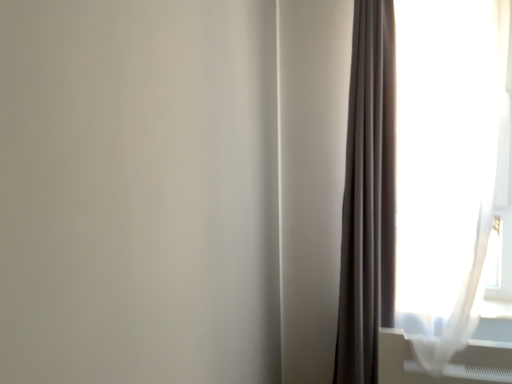
Question: From a real-world perspective, is white sheer curtain at right, the first curtain in the right-to-left sequence, positioned above or below matte gray curtain at right, arranged as the 1th curtain when viewed from the left?

Choices:
 (A) below
 (B) above

Answer: (B)

Question: Considering the relative positions of white sheer curtain at right, which is the second curtain from left to right, and matte gray curtain at right, the second curtain in the right-to-left sequence, in the image provided, is white sheer curtain at right, which is the second curtain from left to right, to the left or to the right of matte gray curtain at right, the second curtain in the right-to-left sequence,?

Choices:
 (A) right
 (B) left

Answer: (A)

Question: Is white sheer curtain at right, the first curtain in the right-to-left sequence, in front of or behind matte gray curtain at right, the second curtain in the right-to-left sequence, in the image?

Choices:
 (A) front
 (B) behind

Answer: (A)

Question: Would you say matte gray curtain at right, arranged as the 1th curtain when viewed from the left, is to the left or to the right of white sheer curtain at right, which is the second curtain from left to right, in the picture?

Choices:
 (A) left
 (B) right

Answer: (A)

Question: In terms of width, does matte gray curtain at right, the second curtain in the right-to-left sequence, look wider or thinner when compared to white sheer curtain at right, which is the second curtain from left to right?

Choices:
 (A) wide
 (B) thin

Answer: (B)

Question: From the image's perspective, relative to white sheer curtain at right, the first curtain in the right-to-left sequence, is matte gray curtain at right, the second curtain in the right-to-left sequence, above or below?

Choices:
 (A) above
 (B) below

Answer: (A)

Question: Is matte gray curtain at right, the second curtain in the right-to-left sequence, in front of or behind white sheer curtain at right, which is the second curtain from left to right, in the image?

Choices:
 (A) behind
 (B) front

Answer: (A)